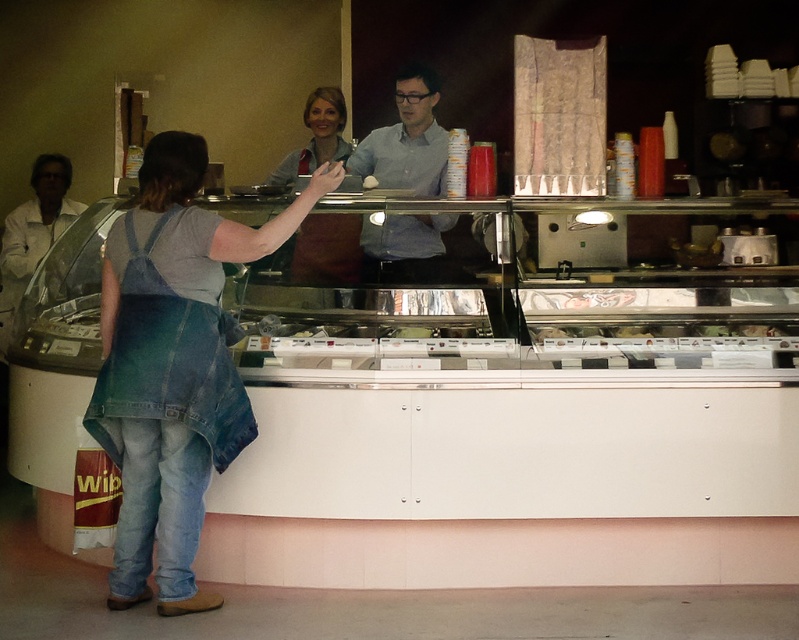
Is denim overalls at left positioned behind white matte jacket at left?

No, it is in front of white matte jacket at left.

Who is shorter, denim overalls at left or white matte jacket at left?

With less height is white matte jacket at left.

Locate an element on the screen. Image resolution: width=799 pixels, height=640 pixels. denim overalls at left is located at coordinates (173, 364).

What are the coordinates of `denim overalls at left` in the screenshot? It's located at (173, 364).

Is blue shirt at center above matte blue apron at center?

Actually, blue shirt at center is below matte blue apron at center.

Locate an element on the screen. The width and height of the screenshot is (799, 640). blue shirt at center is located at coordinates (406, 140).

Does point (370, 172) come in front of point (296, 262)?

No.

At what (x,y) coordinates should I click in order to perform the action: click on blue shirt at center. Please return your answer as a coordinate pair (x, y). Image resolution: width=799 pixels, height=640 pixels. Looking at the image, I should click on (406, 140).

Does denim overalls at left have a greater height compared to matte blue apron at center?

Indeed, denim overalls at left has a greater height compared to matte blue apron at center.

The width and height of the screenshot is (799, 640). In order to click on denim overalls at left in this screenshot , I will do `click(173, 364)`.

Is point (134, 282) positioned after point (332, 260)?

No, it is in front of (332, 260).

Where is `denim overalls at left`? This screenshot has width=799, height=640. denim overalls at left is located at coordinates tap(173, 364).